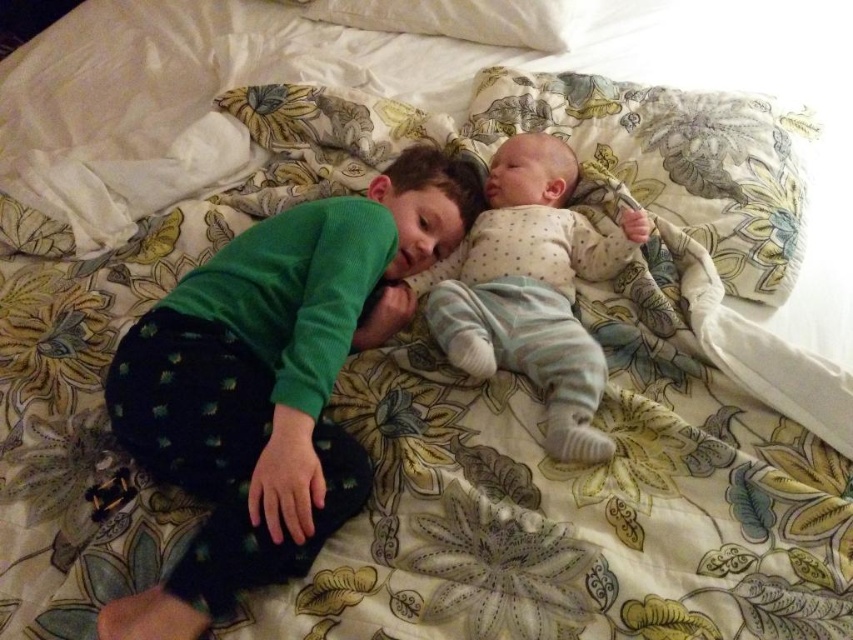
Which is behind, point (698, 193) or point (437, 10)?

Point (437, 10)

This screenshot has height=640, width=853. What do you see at coordinates (675, 161) in the screenshot?
I see `fluffy fabric pillow at upper center` at bounding box center [675, 161].

This screenshot has height=640, width=853. Describe the element at coordinates (675, 161) in the screenshot. I see `fluffy fabric pillow at upper center` at that location.

You are a GUI agent. You are given a task and a screenshot of the screen. Output one action in this format:
    pyautogui.click(x=<x>, y=<y>)
    Task: Click on the fluffy fabric pillow at upper center
    This screenshot has width=853, height=640.
    Given the screenshot: What is the action you would take?
    pyautogui.click(x=675, y=161)

Between green fleece pants at left and white soft pillow at upper center, which one is positioned higher?

white soft pillow at upper center

Which is behind, point (258, 333) or point (486, 35)?

Point (486, 35)

Is point (299, 232) positioned behind point (367, 12)?

That is False.

Locate an element on the screen. green fleece pants at left is located at coordinates (271, 381).

Does fluffy fabric pillow at upper center have a greater height compared to light blue cotton onesie at center?

In fact, fluffy fabric pillow at upper center may be shorter than light blue cotton onesie at center.

I want to click on fluffy fabric pillow at upper center, so click(675, 161).